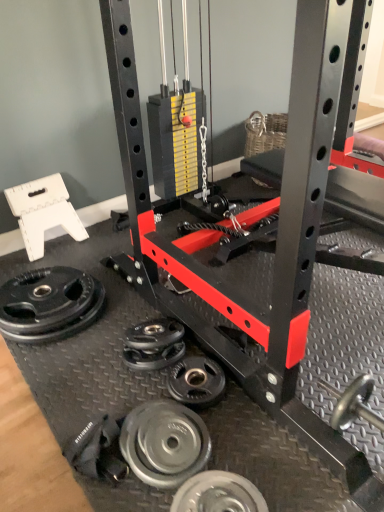
Where is `vacant area that lies to the right of silver metallic weight plate at lower center, marked as the third wheel in a bottom-to-top arrangement`? The image size is (384, 512). vacant area that lies to the right of silver metallic weight plate at lower center, marked as the third wheel in a bottom-to-top arrangement is located at coordinates (248, 409).